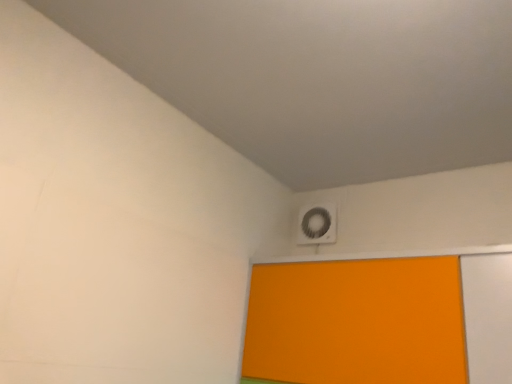
In order to click on white plastic fan at upper right in this screenshot , I will do `click(317, 224)`.

This screenshot has width=512, height=384. What do you see at coordinates (317, 224) in the screenshot? I see `white plastic fan at upper right` at bounding box center [317, 224].

The image size is (512, 384). I want to click on white plastic fan at upper right, so click(317, 224).